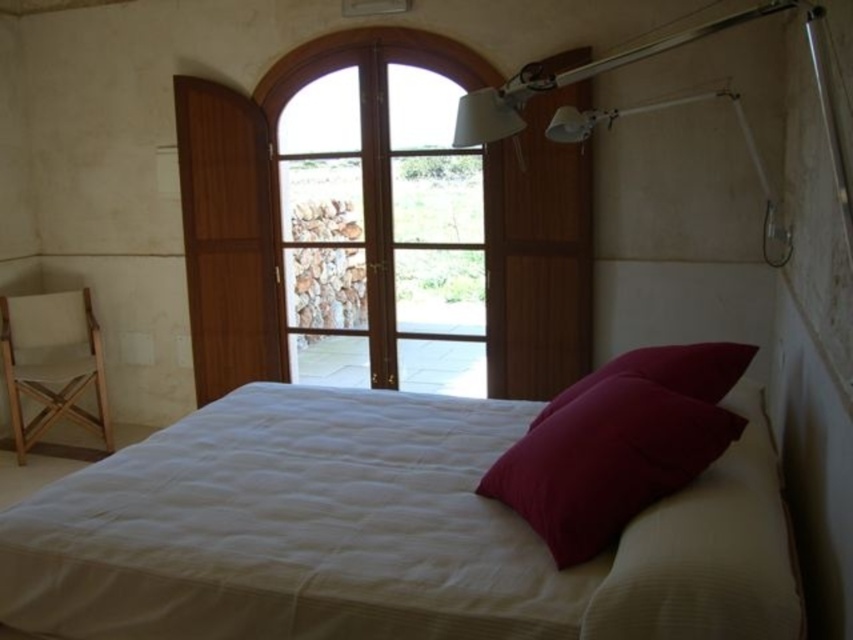
Consider the image. You are standing in the bedroom and want to place a small lamp between the velvet red pillow at center and the beige fabric chair at left. Which object should the lamp be closer to if it needs to be placed nearer to the one that is closer to you?

The velvet red pillow at center is closer to the viewer than the beige fabric chair at left, so the lamp should be placed closer to the velvet red pillow at center.